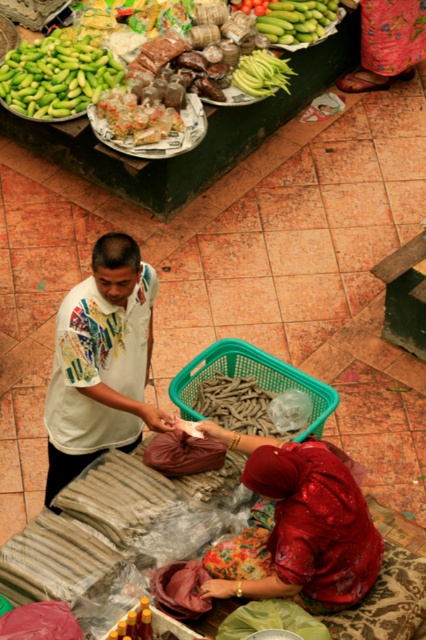
Between shiny red fabric at center and green matte cucumber at upper center, which one appears on the right side from the viewer's perspective?

Positioned to the right is green matte cucumber at upper center.

Can you confirm if shiny red fabric at center is positioned to the right of green matte cucumber at upper center?

In fact, shiny red fabric at center is to the left of green matte cucumber at upper center.

This screenshot has width=426, height=640. What do you see at coordinates (298, 529) in the screenshot?
I see `shiny red fabric at center` at bounding box center [298, 529].

Image resolution: width=426 pixels, height=640 pixels. Identify the location of shiny red fabric at center. (298, 529).

Can you confirm if white printed shirt at center is thinner than green matte cucumber at upper center?

Incorrect, white printed shirt at center's width is not less than green matte cucumber at upper center's.

Based on the photo, who is positioned more to the left, white printed shirt at center or green matte cucumber at upper center?

white printed shirt at center is more to the left.

Does point (112, 317) come farther from viewer compared to point (270, 10)?

No, (112, 317) is in front of (270, 10).

Where is `white printed shirt at center`? white printed shirt at center is located at coordinates (101, 362).

Does point (118, 67) lie behind point (273, 60)?

Yes.

Is green matte beans at upper left above green matte beans at upper center?

Yes, green matte beans at upper left is above green matte beans at upper center.

The width and height of the screenshot is (426, 640). Find the location of `green matte beans at upper left`. green matte beans at upper left is located at coordinates (55, 76).

Image resolution: width=426 pixels, height=640 pixels. I want to click on green matte beans at upper left, so click(x=55, y=76).